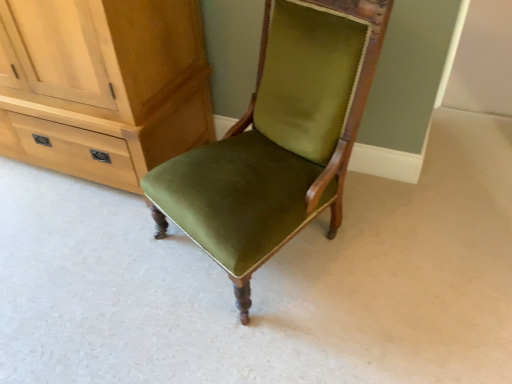
Where is `vacant space to the right of velvet green chair at center`? vacant space to the right of velvet green chair at center is located at coordinates (413, 246).